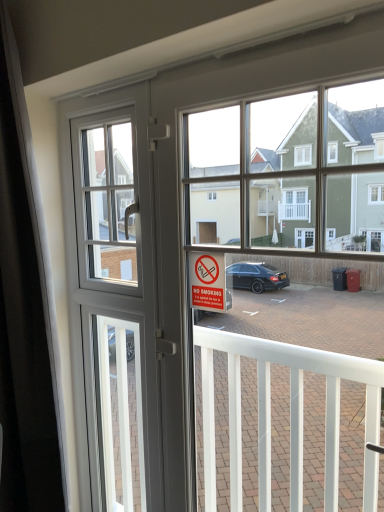
Measure the distance between black matte curtain at left and camera.

The distance of black matte curtain at left from camera is 1.46 meters.

I want to click on black matte curtain at left, so click(x=28, y=302).

Find the location of a particular element. This screenshot has height=512, width=384. white plastic window screen at upper left is located at coordinates (107, 199).

Measure the distance between clear glass screen door at center and camera.

clear glass screen door at center and camera are 5.55 feet apart.

Find the location of a particular element. black matte curtain at left is located at coordinates (28, 302).

Does clear glass screen door at center have a greater height compared to no smoking" sign at center?

Yes.

Based on the photo, from the image's perspective, between clear glass screen door at center and no smoking" sign at center, who is located below?

clear glass screen door at center appears lower in the image.

Is clear glass screen door at center not within no smoking" sign at center?

clear glass screen door at center lies outside no smoking" sign at center's area.

Is point (127, 327) more distant than point (92, 271)?

Yes, it is behind point (92, 271).

Identify the location of window screen on the left of clear glass screen door at center. (107, 199).

Is clear glass screen door at center to the right of white plastic window screen at upper left from the viewer's perspective?

Correct, you'll find clear glass screen door at center to the right of white plastic window screen at upper left.

Does clear glass screen door at center contain white plastic window screen at upper left?

Actually, white plastic window screen at upper left is outside clear glass screen door at center.

Considering the sizes of objects no smoking" sign at center and white plastic window screen at upper left in the image provided, who is wider, no smoking" sign at center or white plastic window screen at upper left?

With larger width is white plastic window screen at upper left.

Is no smoking" sign at center directly adjacent to white plastic window screen at upper left?

no smoking" sign at center and white plastic window screen at upper left are not in contact.

Looking at this image, how different are the orientations of no smoking" sign at center and white plastic window screen at upper left in degrees?

The angle between the facing direction of no smoking" sign at center and the facing direction of white plastic window screen at upper left is 0.0275 degrees.

Can you confirm if no smoking" sign at center is smaller than white plastic window screen at upper left?

Correct, no smoking" sign at center occupies less space than white plastic window screen at upper left.

Is clear glass screen door at center a part of black matte curtain at left?

Actually, clear glass screen door at center is outside black matte curtain at left.

In the scene shown: From the image's perspective, is black matte curtain at left positioned above or below clear glass screen door at center?

From the image's perspective, black matte curtain at left appears above clear glass screen door at center.

Identify the location of screen door directly beneath the black matte curtain at left (from a real-world perspective). The image size is (384, 512). (118, 414).

Can you confirm if black matte curtain at left is positioned to the left of clear glass screen door at center?

Yes.

Considering the positions of objects white plastic window screen at upper left and black matte curtain at left in the image provided, who is more to the right, white plastic window screen at upper left or black matte curtain at left?

From the viewer's perspective, white plastic window screen at upper left appears more on the right side.

Considering the relative sizes of white plastic window screen at upper left and black matte curtain at left in the image provided, is white plastic window screen at upper left wider than black matte curtain at left?

No, white plastic window screen at upper left is not wider than black matte curtain at left.

Identify the location of window screen behind the black matte curtain at left. This screenshot has height=512, width=384. (107, 199).

Is white plastic window screen at upper left further to camera compared to black matte curtain at left?

Yes, it is behind black matte curtain at left.

Who is taller, no smoking" sign at center or black matte curtain at left?

With more height is black matte curtain at left.

This screenshot has height=512, width=384. In order to click on curtain in front of the no smoking" sign at center in this screenshot , I will do click(x=28, y=302).

From the image's perspective, is no smoking" sign at center over black matte curtain at left?

Yes, from the image's perspective, no smoking" sign at center is over black matte curtain at left.

Does black matte curtain at left have a smaller size compared to white plastic window screen at upper left?

No.

Is black matte curtain at left to the right of white plastic window screen at upper left from the viewer's perspective?

Incorrect, black matte curtain at left is not on the right side of white plastic window screen at upper left.

From the image's perspective, who appears lower, black matte curtain at left or white plastic window screen at upper left?

black matte curtain at left appears lower in the image.

This screenshot has width=384, height=512. Identify the location of parking sign that appears above the clear glass screen door at center (from the image's perspective). (207, 281).

Locate an element on the screen. This screenshot has height=512, width=384. screen door behind the white plastic window screen at upper left is located at coordinates (118, 414).

Which object lies further to the anchor point black matte curtain at left, white plastic window screen at upper left or no smoking" sign at center?

no smoking" sign at center is further to black matte curtain at left.

When comparing their distances from black matte curtain at left, does white plastic window screen at upper left or clear glass screen door at center seem further?

The object further to black matte curtain at left is clear glass screen door at center.

Estimate the real-world distances between objects in this image. Which object is further from clear glass screen door at center, no smoking" sign at center or black matte curtain at left?

no smoking" sign at center.

Which object lies further to the anchor point white plastic window screen at upper left, black matte curtain at left or clear glass screen door at center?

clear glass screen door at center is positioned further to the anchor white plastic window screen at upper left.

Which object lies further to the anchor point clear glass screen door at center, no smoking" sign at center or white plastic window screen at upper left?

The object further to clear glass screen door at center is no smoking" sign at center.

From the image, which object appears to be farther from clear glass screen door at center, black matte curtain at left or white plastic window screen at upper left?

white plastic window screen at upper left is positioned further to the anchor clear glass screen door at center.

Based on their spatial positions, is no smoking" sign at center or black matte curtain at left closer to white plastic window screen at upper left?

Among the two, black matte curtain at left is located nearer to white plastic window screen at upper left.

Considering their positions, is clear glass screen door at center positioned closer to black matte curtain at left than no smoking" sign at center?

Among the two, clear glass screen door at center is located nearer to black matte curtain at left.

This screenshot has height=512, width=384. Find the location of `screen door between black matte curtain at left and no smoking" sign at center`. screen door between black matte curtain at left and no smoking" sign at center is located at coordinates (118, 414).

This screenshot has height=512, width=384. Identify the location of parking sign between white plastic window screen at upper left and clear glass screen door at center from top to bottom. (207, 281).

Find the location of a particular element. Image resolution: width=384 pixels, height=512 pixels. window screen between black matte curtain at left and no smoking" sign at center is located at coordinates (107, 199).

Locate an element on the screen. curtain between white plastic window screen at upper left and clear glass screen door at center in the up-down direction is located at coordinates (28, 302).